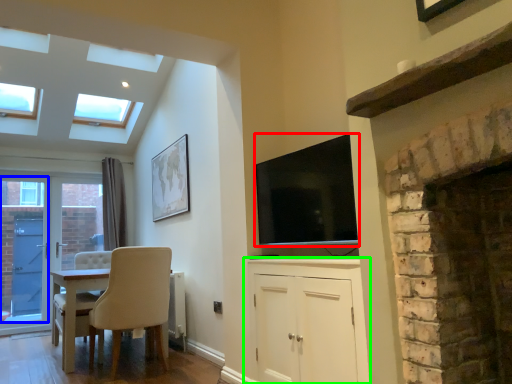
Question: Based on their relative distances, which object is nearer to television (highlighted by a red box)? Choose from glass door (highlighted by a blue box) and cabinetry (highlighted by a green box).

Choices:
 (A) glass door
 (B) cabinetry

Answer: (B)